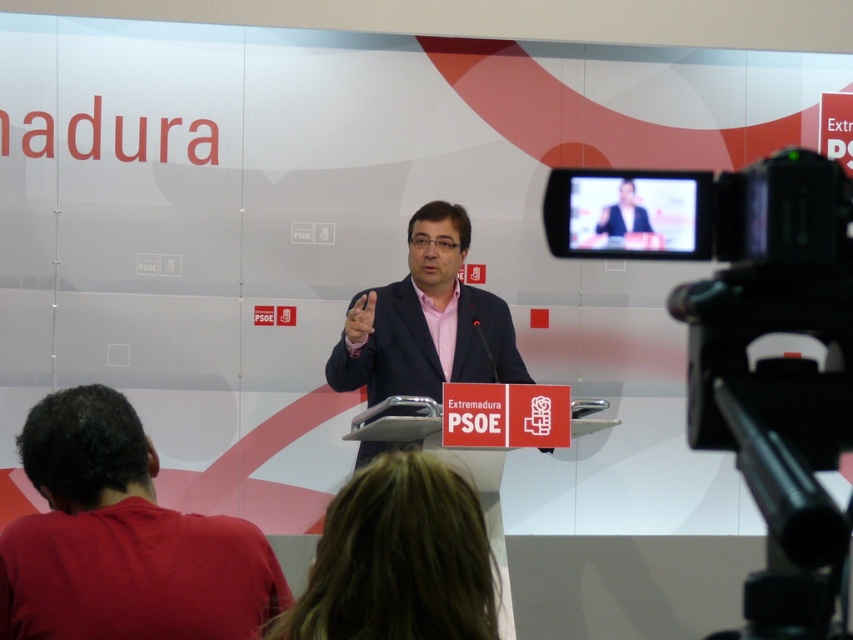
Is point (183, 609) more distant than point (646, 218)?

That is True.

Is dark red shirt at lower left to the right of matte black suit at center from the viewer's perspective?

Incorrect, dark red shirt at lower left is not on the right side of matte black suit at center.

Locate an element on the screen. This screenshot has height=640, width=853. dark red shirt at lower left is located at coordinates (122, 540).

Who is more distant from viewer, (x=701, y=324) or (x=604, y=211)?

Point (x=604, y=211)

Does black plastic video camera at right have a lesser width compared to matte black suit at center?

Incorrect, black plastic video camera at right's width is not less than matte black suit at center's.

Is point (769, 589) positioned before point (618, 225)?

Yes, point (769, 589) is closer to viewer.

Image resolution: width=853 pixels, height=640 pixels. I want to click on black plastic video camera at right, so click(x=776, y=372).

What do you see at coordinates (776, 372) in the screenshot? I see `black plastic video camera at right` at bounding box center [776, 372].

Between black plastic video camera at right and dark red shirt at lower left, which one appears on the left side from the viewer's perspective?

Positioned to the left is dark red shirt at lower left.

Find the location of a particular element. This screenshot has height=640, width=853. black plastic video camera at right is located at coordinates (776, 372).